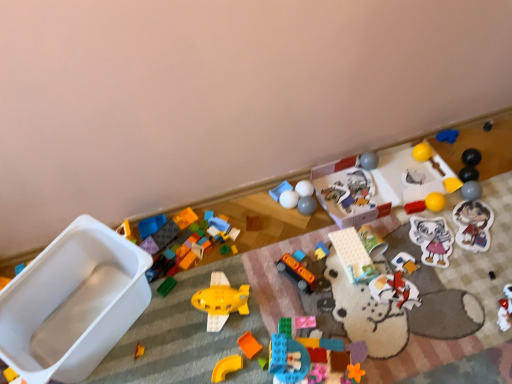
Where is `vacant space that's between rubber duck at center, which ranks as the eleventh toy in right-to-left order, and yellow plastic airplane at center, the 22th toy in the right-to-left sequence`? The width and height of the screenshot is (512, 384). vacant space that's between rubber duck at center, which ranks as the eleventh toy in right-to-left order, and yellow plastic airplane at center, the 22th toy in the right-to-left sequence is located at coordinates (269, 283).